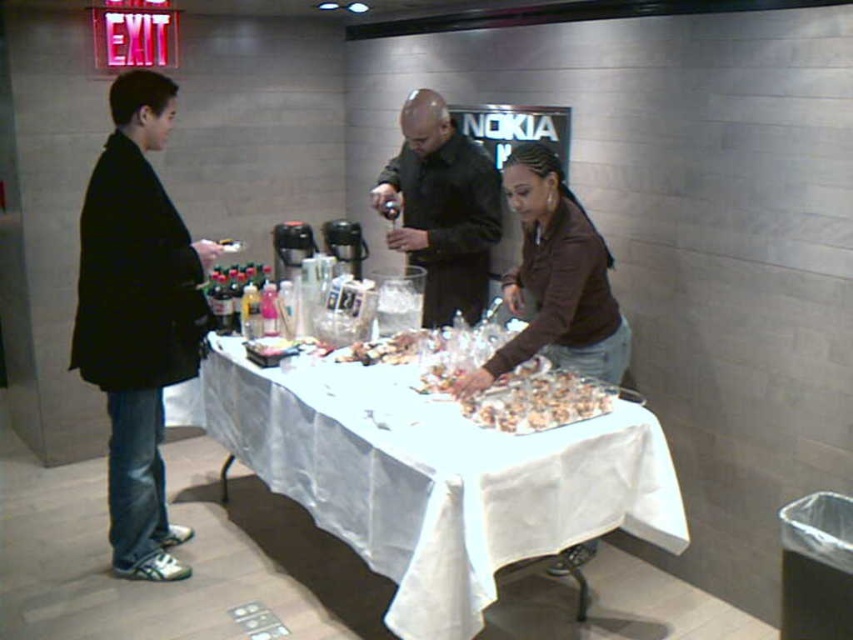
Can you confirm if white cloth-covered table at center is shorter than crumbly brown pastry at center?

No.

Is point (321, 458) closer to viewer compared to point (416, 346)?

Yes, it is in front of point (416, 346).

The width and height of the screenshot is (853, 640). Identify the location of white cloth-covered table at center. (436, 477).

Can you confirm if brown matte shirt at center is positioned above crumbly brown pastry at center?

Indeed, brown matte shirt at center is positioned over crumbly brown pastry at center.

Which is above, brown matte shirt at center or crumbly brown pastry at center?

brown matte shirt at center is above.

Who is more distant from viewer, (479, 368) or (355, 348)?

Point (355, 348)

At what (x,y) coordinates should I click in order to perform the action: click on brown matte shirt at center. Please return your answer as a coordinate pair (x, y). The image size is (853, 640). Looking at the image, I should click on (555, 280).

Which of these two, black matte shirt at center or slightly browned plastic tray at center, stands taller?

Standing taller between the two is black matte shirt at center.

Who is more distant from viewer, (494, 225) or (541, 387)?

Positioned behind is point (494, 225).

Find the location of `black matte shirt at center`. black matte shirt at center is located at coordinates (442, 209).